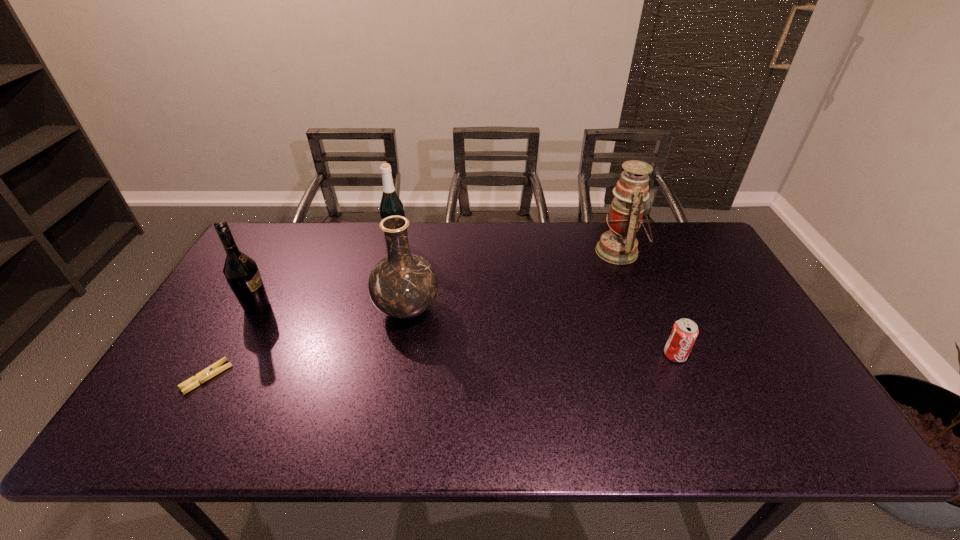
Find the location of `blank space at the far left corner of the desktop`. blank space at the far left corner of the desktop is located at coordinates (260, 258).

Find the location of a particular element. This screenshot has width=960, height=540. vacant space at the far right corner of the desktop is located at coordinates (680, 261).

The height and width of the screenshot is (540, 960). What are the coordinates of `unoccupied area between the vase and the nearer wine bottle` in the screenshot? It's located at (332, 308).

At what (x,y) coordinates should I click in order to perform the action: click on blank region between the second shortest object and the right wine bottle. Please return your answer as a coordinate pair (x, y). Looking at the image, I should click on (536, 301).

Locate an element on the screen. empty location between the vase and the second shortest object is located at coordinates (540, 332).

Locate an element on the screen. This screenshot has height=540, width=960. free space between the oil lamp and the nearer wine bottle is located at coordinates (438, 279).

Identify the location of vacant area that lies between the fifth tallest object and the left wine bottle. (467, 331).

Find the location of a particular element. free space between the clothespin and the right wine bottle is located at coordinates (302, 312).

You are a GUI agent. You are given a task and a screenshot of the screen. Output one action in this format:
    pyautogui.click(x=<x>, y=<y>)
    Task: Click on the unoccupied position between the clothespin and the nearer wine bottle
    
    Given the screenshot: What is the action you would take?
    pyautogui.click(x=232, y=342)

I want to click on vacant area that lies between the oil lamp and the right wine bottle, so click(x=508, y=249).